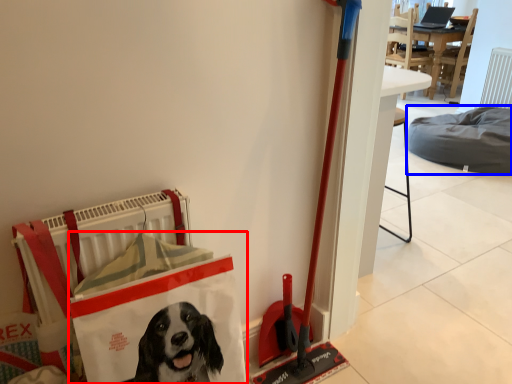
Question: Which of the following is the farthest to the observer, shopping bag (highlighted by a red box) or dog bed (highlighted by a blue box)?

Choices:
 (A) shopping bag
 (B) dog bed

Answer: (B)